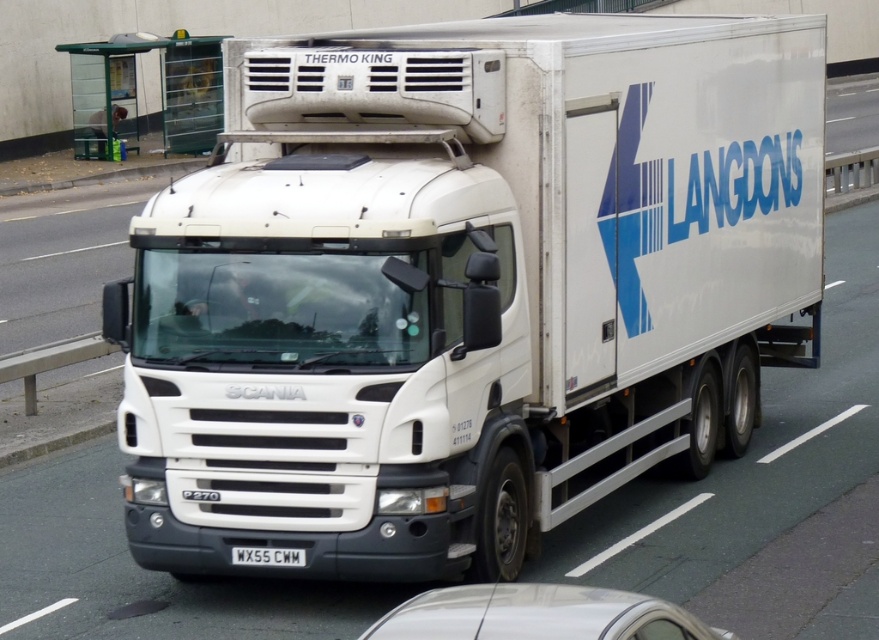
Question: Estimate the real-world distances between objects in this image. Which object is closer to the white plastic license plate at center?

Choices:
 (A) white matte truck at center
 (B) white glossy car at lower center

Answer: (A)

Question: Does white matte truck at center appear over white glossy car at lower center?

Choices:
 (A) no
 (B) yes

Answer: (B)

Question: Which object appears closest to the camera in this image?

Choices:
 (A) white glossy car at lower center
 (B) white plastic license plate at center

Answer: (A)

Question: Can you confirm if white matte truck at center is positioned below white glossy car at lower center?

Choices:
 (A) yes
 (B) no

Answer: (B)

Question: Can you confirm if white matte truck at center is thinner than white glossy car at lower center?

Choices:
 (A) yes
 (B) no

Answer: (A)

Question: Which object is closer to the camera taking this photo?

Choices:
 (A) white matte truck at center
 (B) white glossy car at lower center

Answer: (B)